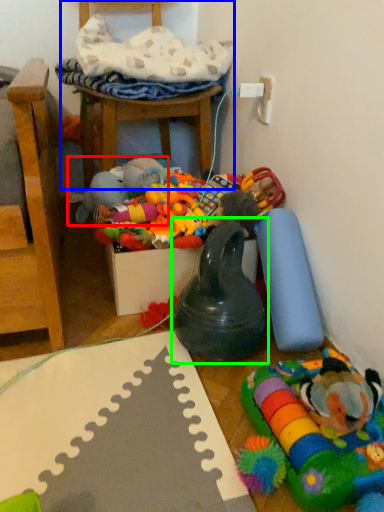
Question: Which is nearer to the toy (highlighted by a red box)? chair (highlighted by a blue box) or toy (highlighted by a green box).

Choices:
 (A) chair
 (B) toy

Answer: (A)